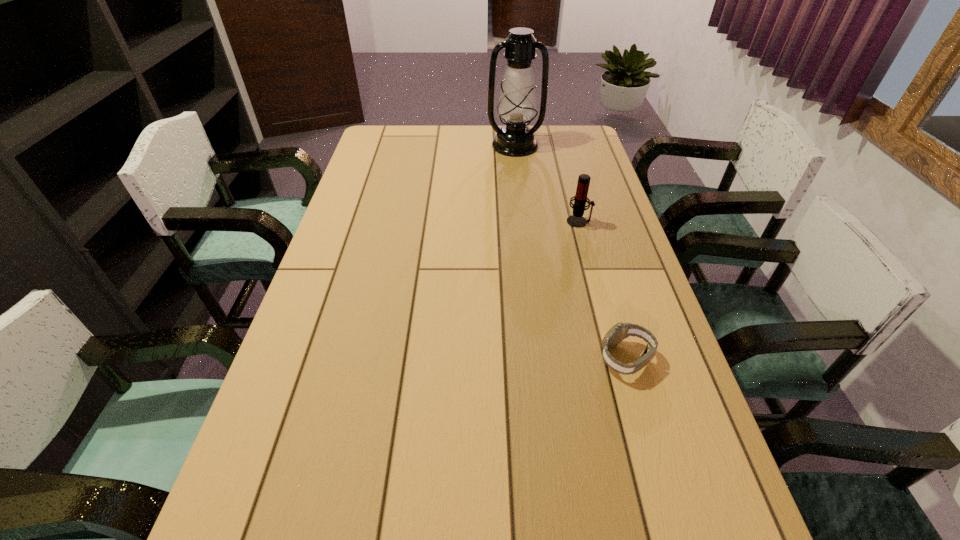
Find the location of `empty space that is in between the watch and the tallest object`. empty space that is in between the watch and the tallest object is located at coordinates (570, 252).

This screenshot has height=540, width=960. I want to click on free point between the second shortest object and the watch, so click(x=603, y=290).

Identify the location of unoccupied area between the second nearest object and the watch. (603, 290).

This screenshot has height=540, width=960. Identify the location of vacant area that lies between the farthest object and the shortest object. (570, 252).

Where is `empty space between the microphone and the leftmost object`? Image resolution: width=960 pixels, height=540 pixels. empty space between the microphone and the leftmost object is located at coordinates (547, 184).

Find the location of a particular element. This screenshot has width=960, height=540. vacant space in between the oil lamp and the microphone is located at coordinates (547, 184).

Identify the location of vacant space in between the watch and the second farthest object. Image resolution: width=960 pixels, height=540 pixels. (603, 290).

Identify which object is the second closest to the microphone. Please provide its 2D coordinates. Your answer should be formatted as a tuple, i.e. [(x, y)], where the tuple contains the x and y coordinates of a point satisfying the conditions above.

[(620, 331)]

This screenshot has width=960, height=540. Find the location of `object that ranks as the second closest to the second farthest object`. object that ranks as the second closest to the second farthest object is located at coordinates (620, 331).

The height and width of the screenshot is (540, 960). What are the coordinates of `vacant space that satisfies the following two spatial constraints: 1. on the front side of the second nearest object; 2. on the right side of the farthest object` in the screenshot? It's located at (524, 221).